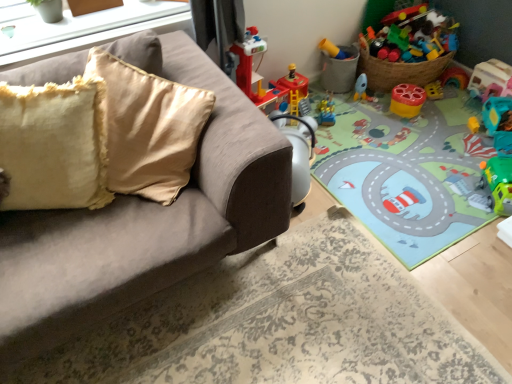
Identify the location of vacant space that is in between green plastic toy car at lower right, the third toy from the right, and yellow plastic cup at center-right, the 3th toy from the left. The image size is (512, 384). (444, 145).